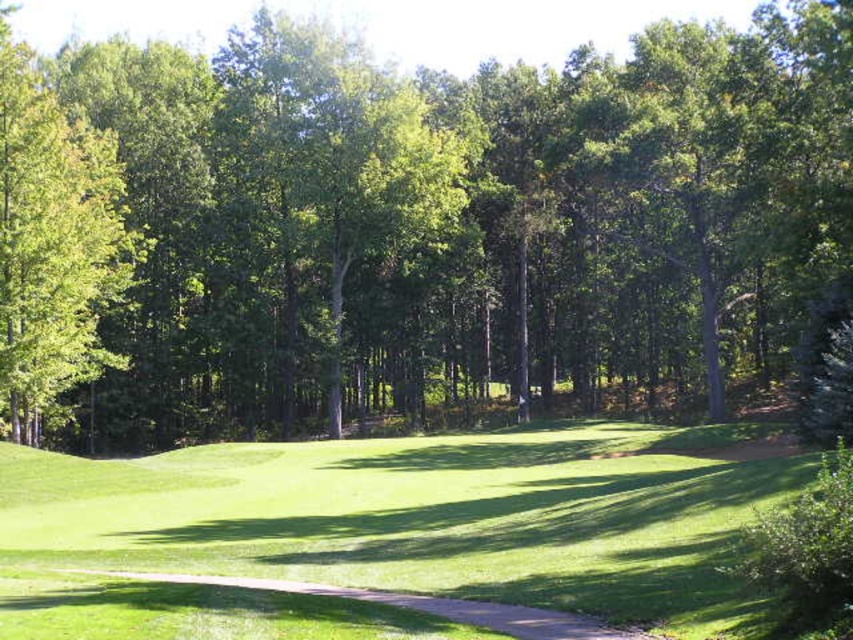
Does green leafy tree at center appear under green leafy tree at left?

Yes, green leafy tree at center is below green leafy tree at left.

Which is in front, point (41, 209) or point (74, 156)?

Point (41, 209)

This screenshot has height=640, width=853. What do you see at coordinates (413, 227) in the screenshot?
I see `green leafy tree at center` at bounding box center [413, 227].

Find the location of a particular element. Image resolution: width=853 pixels, height=640 pixels. green leafy tree at center is located at coordinates (413, 227).

Who is shorter, green grassy golf course at center or brown gravel path at center?

Standing shorter between the two is brown gravel path at center.

Is green grassy golf course at center smaller than brown gravel path at center?

No.

Does point (633, 444) lie behind point (514, 608)?

Yes, it is.

In order to click on green grassy golf course at center in this screenshot , I will do point(426,516).

Does green grassy golf course at center have a greater height compared to green leafy tree at left?

No.

Which is in front, point (614, 611) or point (76, 362)?

Point (614, 611) is in front.

This screenshot has width=853, height=640. Describe the element at coordinates (426, 516) in the screenshot. I see `green grassy golf course at center` at that location.

Where is `green grassy golf course at center`? This screenshot has height=640, width=853. green grassy golf course at center is located at coordinates (426, 516).